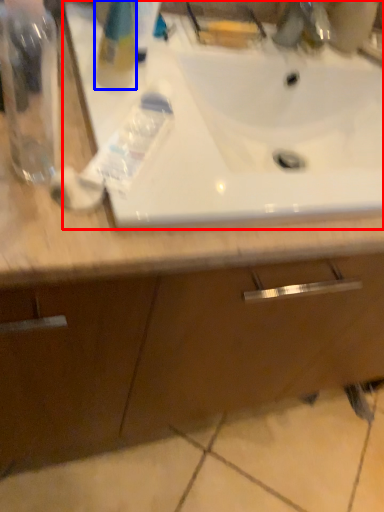
Question: Which point is closer to the camera, sink (highlighted by a red box) or cleaning product (highlighted by a blue box)?

Choices:
 (A) sink
 (B) cleaning product

Answer: (A)